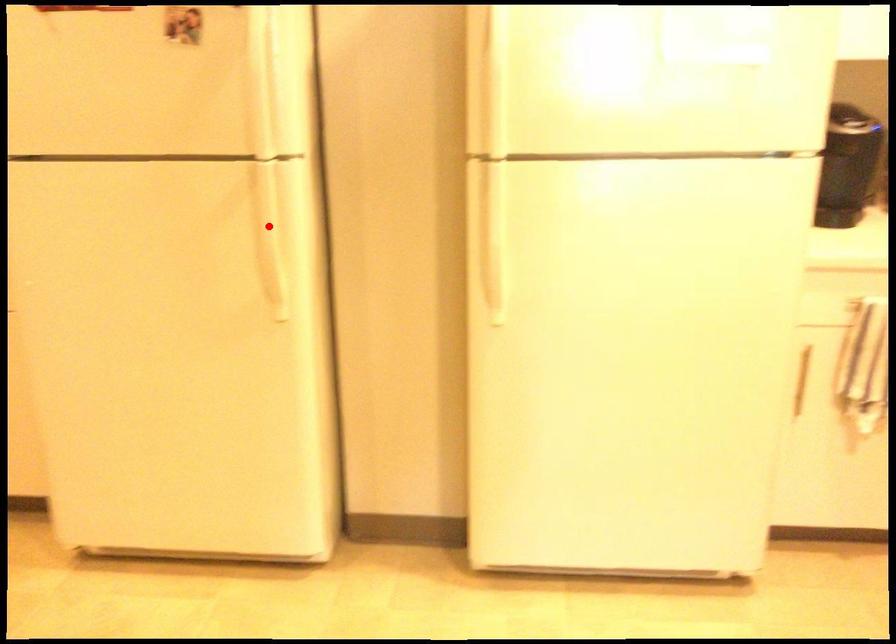
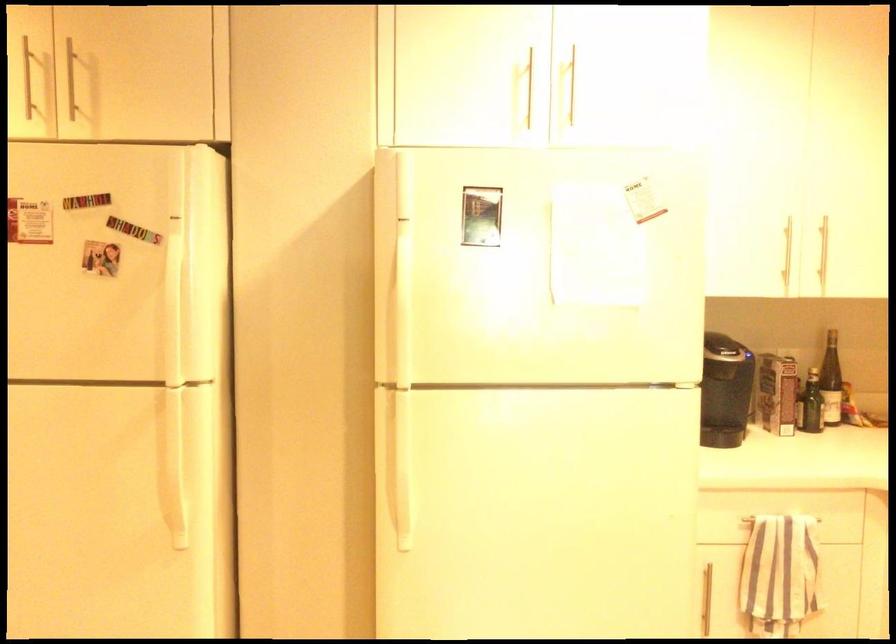
Locate, in the second image, the point that corresponds to the highlighted location in the first image.

(170, 453)